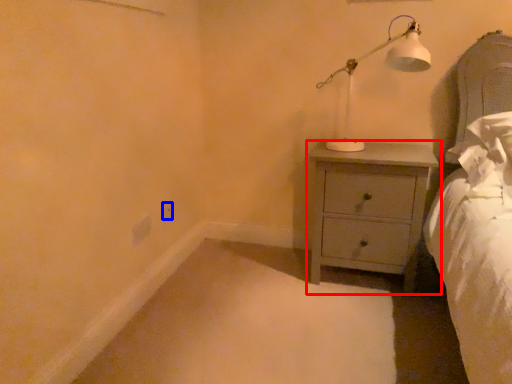
Question: Which of the following is the farthest to the observer, chest of drawers (highlighted by a red box) or electric outlet (highlighted by a blue box)?

Choices:
 (A) chest of drawers
 (B) electric outlet

Answer: (B)